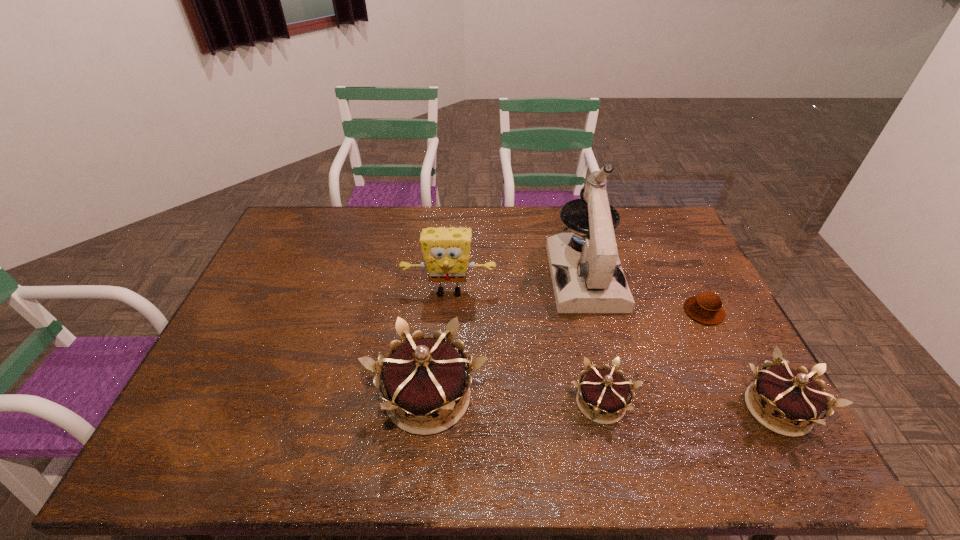
Identify the location of the leftmost crown. (425, 377).

This screenshot has width=960, height=540. Identify the location of the shortest crown. (606, 392).

Where is `the second crown from left to right`? The height and width of the screenshot is (540, 960). the second crown from left to right is located at coordinates (606, 392).

Where is `the second tallest crown`? This screenshot has width=960, height=540. the second tallest crown is located at coordinates (796, 401).

Identify the location of the rightmost crown. (796, 401).

The width and height of the screenshot is (960, 540). Find the location of `sponge`. sponge is located at coordinates (446, 251).

The width and height of the screenshot is (960, 540). What are the coordinates of `microscope` in the screenshot? It's located at (592, 281).

What are the coordinates of `muffin` in the screenshot? It's located at (706, 307).

The width and height of the screenshot is (960, 540). Find the location of `vacant space situated 0.110m on the back of the tallest crown`. vacant space situated 0.110m on the back of the tallest crown is located at coordinates (435, 325).

Identify the location of vacant region located 0.050m on the left of the shortest crown. (546, 403).